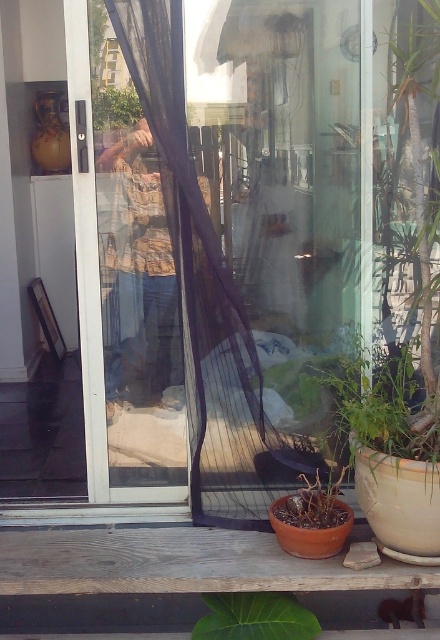
You are standing at the point closest to the sliding door in the image. There are two points marked in the scene, one at coordinates point (271,492) and another at point (407,397). Which of these points is farther away from you?

Point (271,492) is behind point (407,397), so the point farther away from you is point (271,492).

Consider the image. You are standing in the room and want to reach the point marked as point (178, 173). Can you walk directly to it from your current position?

The point (178, 173) is 8.21 feet away from the camera, so yes, you can walk directly to it from your current position if there are no obstacles in the way.

You are trying to determine which green leafy plant is taller between the green leafy plant at lower right and the green leafy plant at center. Based on the scene, which one is taller?

The green leafy plant at lower right is much taller than the green leafy plant at center.